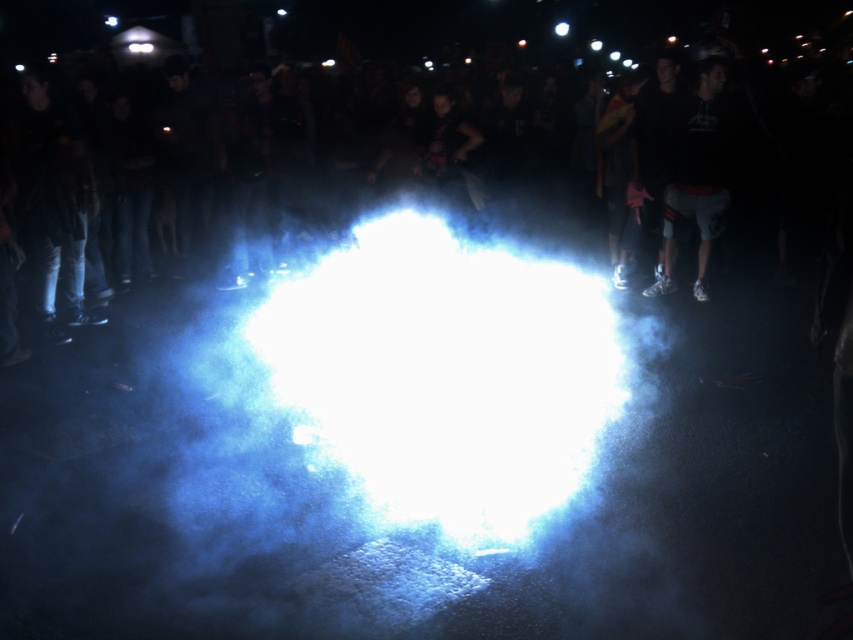
Which is more to the left, black matte crowd at center or white bright light at center?

From the viewer's perspective, white bright light at center appears more on the left side.

Does black matte crowd at center come behind white bright light at center?

No, black matte crowd at center is in front of white bright light at center.

Does point (283, 125) lie in front of point (537, 497)?

No, it is behind (537, 497).

The width and height of the screenshot is (853, 640). Find the location of `black matte crowd at center`. black matte crowd at center is located at coordinates (451, 161).

Between black matte crowd at center and dark gray shorts at right, which one appears on the right side from the viewer's perspective?

Positioned to the right is dark gray shorts at right.

Can you confirm if black matte crowd at center is thinner than dark gray shorts at right?

No.

Where is `black matte crowd at center`? The width and height of the screenshot is (853, 640). black matte crowd at center is located at coordinates (451, 161).

Is white bright light at center to the left of dark gray shorts at right from the viewer's perspective?

Correct, you'll find white bright light at center to the left of dark gray shorts at right.

Does white bright light at center appear under dark gray shorts at right?

Yes.

Is point (445, 442) closer to viewer compared to point (704, 260)?

Yes, point (445, 442) is closer to viewer.

Locate an element on the screen. white bright light at center is located at coordinates (445, 374).